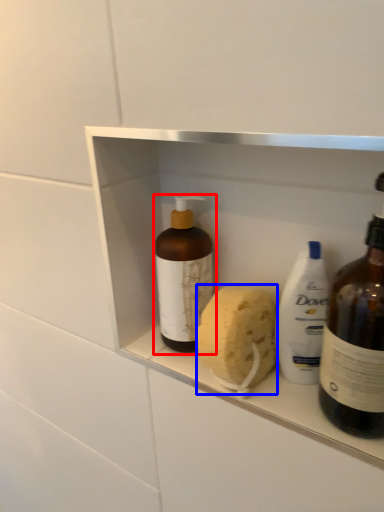
Question: Which object is closer to the camera taking this photo, bottle (highlighted by a red box) or soap (highlighted by a blue box)?

Choices:
 (A) bottle
 (B) soap

Answer: (B)